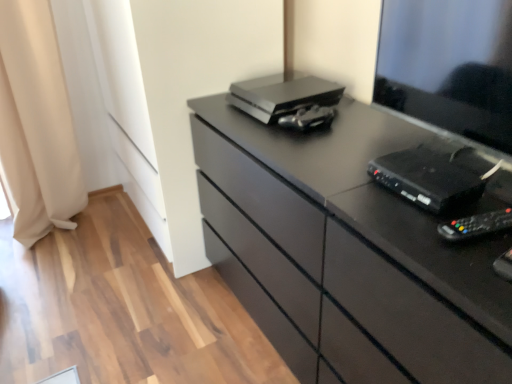
The image size is (512, 384). Find the location of `free space to the back side of black plastic device at right, which ranks as the 2th equipment in front-to-back order`. free space to the back side of black plastic device at right, which ranks as the 2th equipment in front-to-back order is located at coordinates (381, 151).